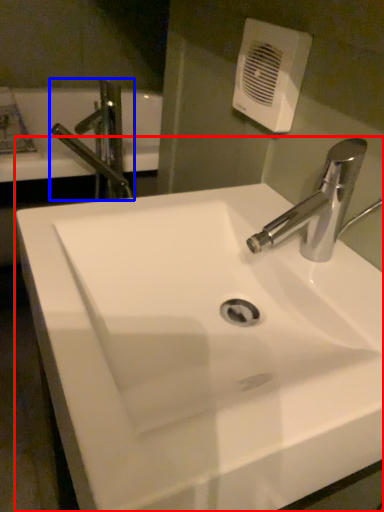
Question: Which of the following is the farthest to the observer, sink (highlighted by a red box) or tap (highlighted by a blue box)?

Choices:
 (A) sink
 (B) tap

Answer: (B)